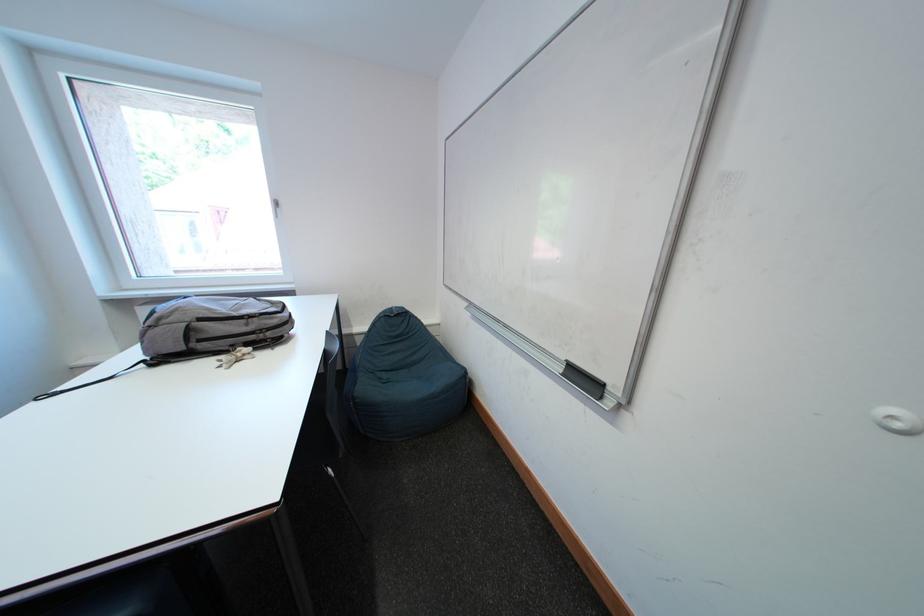
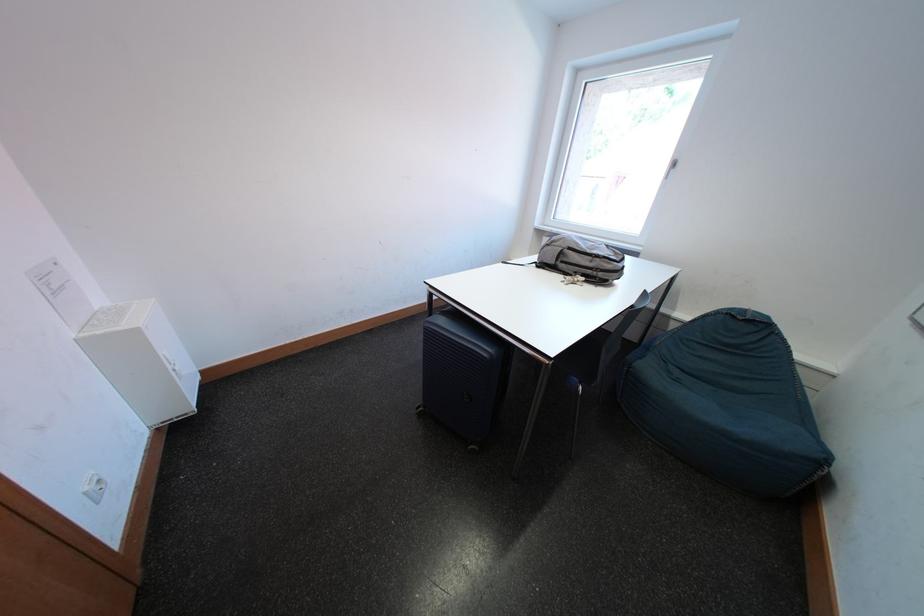
In the second image, find the point that corresponds to (x=394, y=379) in the first image.

(687, 376)